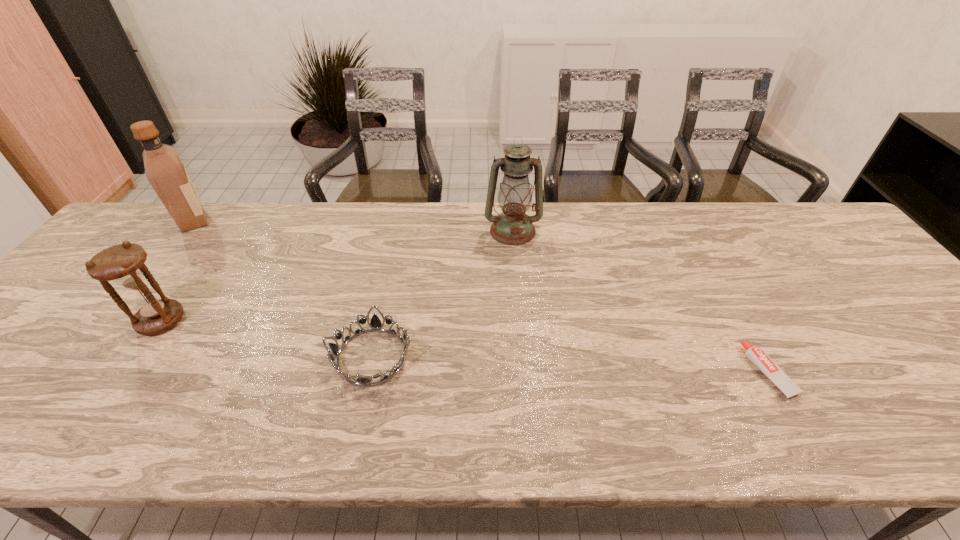
Locate an element on the screen. The width and height of the screenshot is (960, 540). liquor is located at coordinates (164, 169).

Find the location of a particular element. the second object from right to left is located at coordinates (512, 226).

At what (x,y) coordinates should I click in order to perform the action: click on the third tallest object. Please return your answer as a coordinate pair (x, y). This screenshot has width=960, height=540. Looking at the image, I should click on (123, 264).

The height and width of the screenshot is (540, 960). I want to click on the third object from left to right, so click(375, 323).

At what (x,y) coordinates should I click in order to perform the action: click on tiara. Please return your answer as a coordinate pair (x, y). The image size is (960, 540). Looking at the image, I should click on (375, 323).

At what (x,y) coordinates should I click in order to perform the action: click on the shortest object. Please return your answer as a coordinate pair (x, y). Looking at the image, I should click on (756, 355).

Identify the location of toothpaste. (756, 355).

In order to click on free space located on the front-facing side of the liquor in this screenshot , I will do `click(251, 220)`.

Identify the location of free region located on the right of the second object from right to left. (624, 231).

Find the location of a particular element. The image size is (960, 540). free spot located 0.330m on the right of the hourglass is located at coordinates (318, 320).